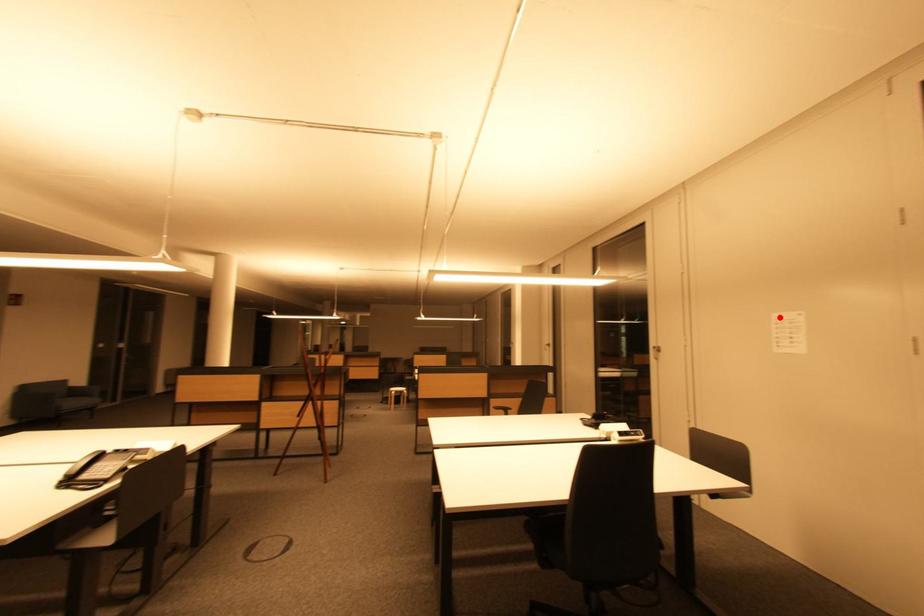
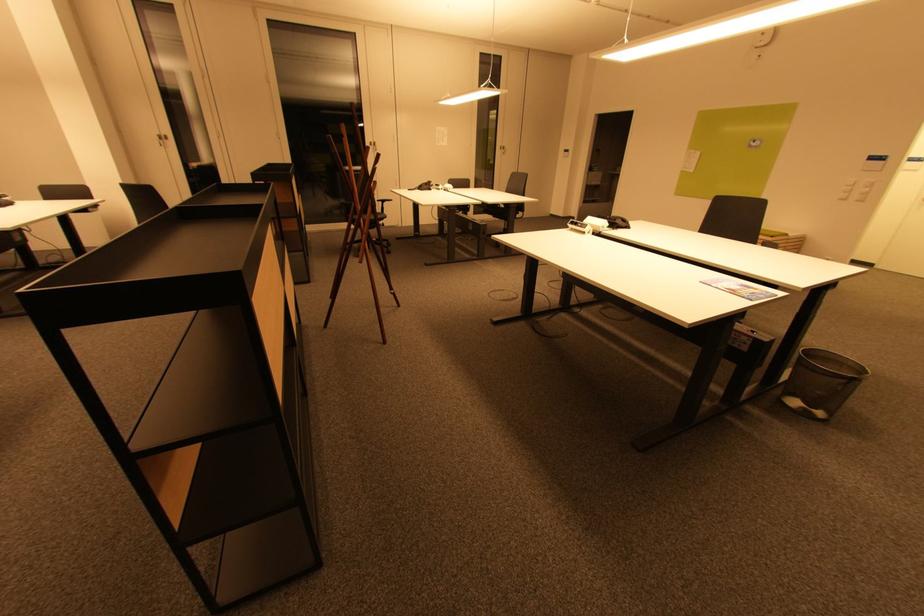
Locate, in the second image, the point that corresponds to the highlighted location in the first image.

(442, 130)